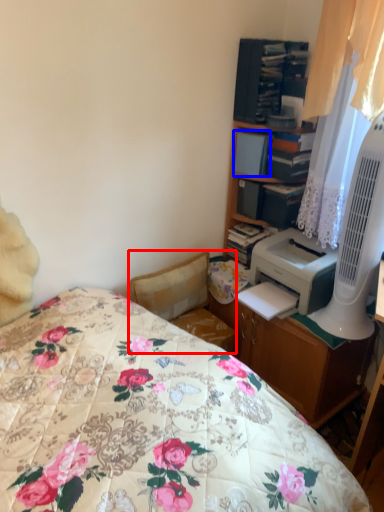
Question: Which point is closer to the camera, swivel chair (highlighted by a red box) or book (highlighted by a blue box)?

Choices:
 (A) swivel chair
 (B) book

Answer: (A)